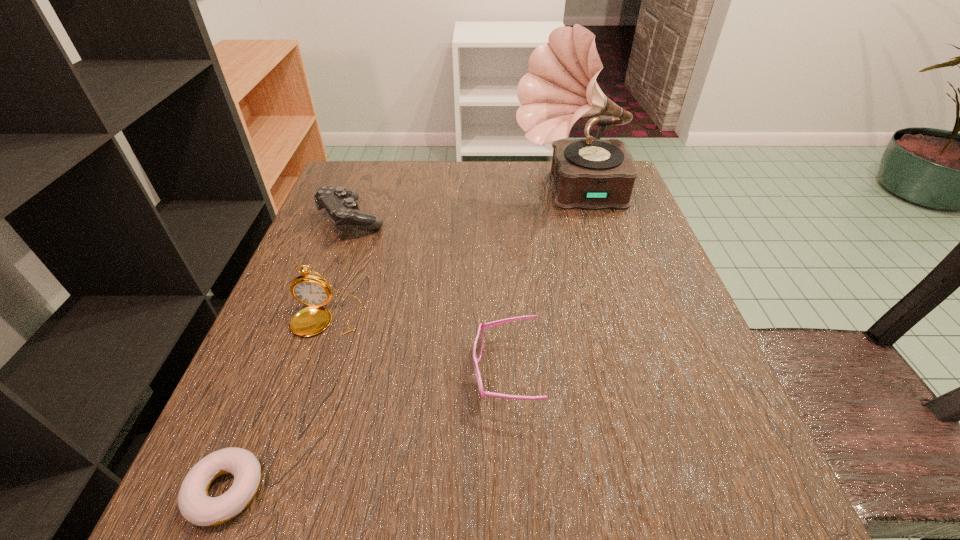
Where is `vacant region located 0.120m on the front of the third shortest object`? This screenshot has height=540, width=960. vacant region located 0.120m on the front of the third shortest object is located at coordinates (328, 281).

The height and width of the screenshot is (540, 960). Identify the location of free space located 0.330m on the front-facing side of the second shortest object. (260, 373).

Where is `vacant space positioned 0.200m on the front-facing side of the second shortest object`? This screenshot has width=960, height=540. vacant space positioned 0.200m on the front-facing side of the second shortest object is located at coordinates (344, 373).

Find the location of `blank area located on the front-facing side of the second shortest object`. blank area located on the front-facing side of the second shortest object is located at coordinates (338, 373).

I want to click on free space located on the right of the shortest object, so click(445, 490).

Locate an element on the screen. Image resolution: width=960 pixels, height=540 pixels. record player that is at the far edge is located at coordinates (561, 87).

This screenshot has height=540, width=960. In order to click on control positioned at the far edge in this screenshot , I will do `click(341, 203)`.

Image resolution: width=960 pixels, height=540 pixels. I want to click on object that is positioned at the near edge, so click(x=195, y=505).

This screenshot has height=540, width=960. Find the location of `pocket watch located in the left edge section of the desktop`. pocket watch located in the left edge section of the desktop is located at coordinates (311, 290).

Identify the location of control that is at the left edge. (341, 203).